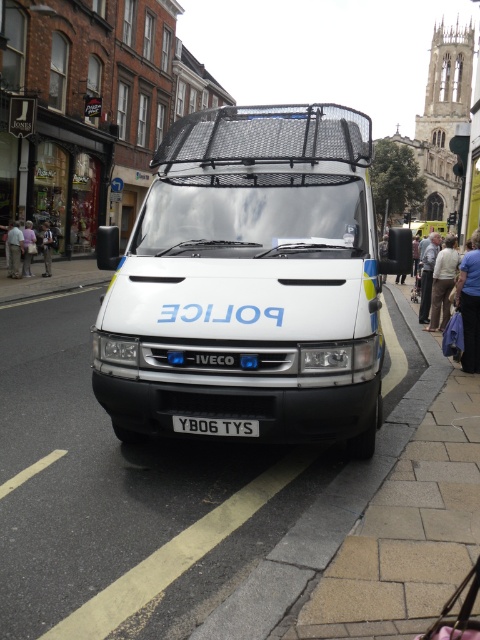
Looking at this image, who is positioned more to the right, light beige jacket at center or light brown leather jacket at center?

light brown leather jacket at center is more to the right.

Consider the image. Can you confirm if light beige jacket at center is wider than light brown leather jacket at center?

Correct, the width of light beige jacket at center exceeds that of light brown leather jacket at center.

Is point (22, 275) farther from viewer compared to point (44, 227)?

That is False.

Where is `light beige jacket at center`? The width and height of the screenshot is (480, 640). light beige jacket at center is located at coordinates (27, 248).

Which of these two, light beige fabric coat at right or white plastic license plate at center, stands shorter?

white plastic license plate at center is shorter.

Looking at this image, does light beige fabric coat at right come in front of white plastic license plate at center?

No, it is behind white plastic license plate at center.

This screenshot has width=480, height=640. I want to click on light beige fabric coat at right, so click(443, 282).

This screenshot has width=480, height=640. Identify the location of light beige fabric coat at right. pos(443,282).

Between white plastic license plate at center and light beige jacket at center, which one appears on the left side from the viewer's perspective?

Positioned to the left is light beige jacket at center.

Is white plastic license plate at center further to the viewer compared to light beige jacket at center?

No, white plastic license plate at center is closer to the viewer.

Which is behind, point (180, 422) or point (32, 253)?

Point (32, 253)

Find the location of a particular element. This screenshot has height=640, width=480. white plastic license plate at center is located at coordinates (216, 426).